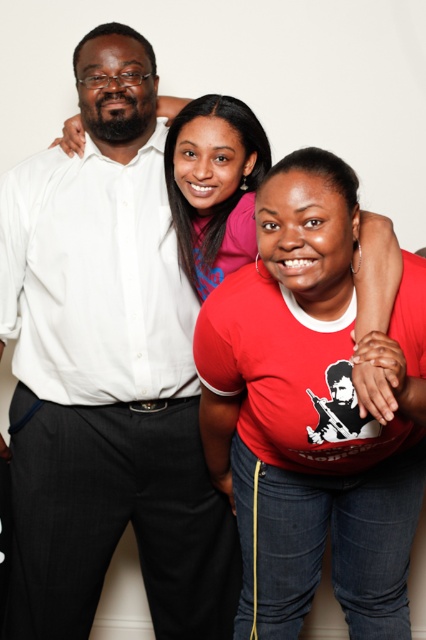
You are standing in front of the image and notice a specific point at coordinates (106, 372). What object is located at this point?

The white shirt at center is located at point (106, 372).